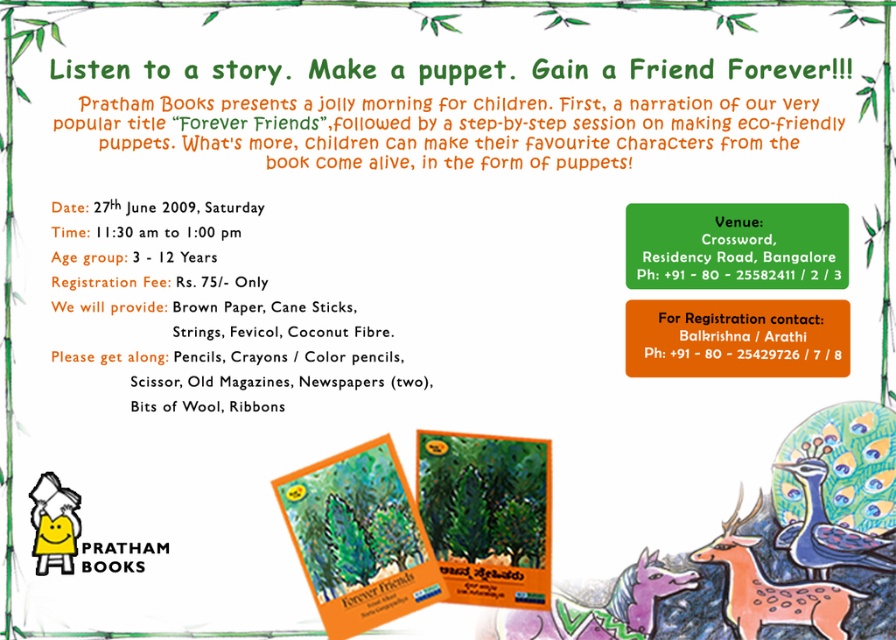
Can you confirm if matte orange deer at center is positioned below blue glossy peacock at center?

Yes, matte orange deer at center is below blue glossy peacock at center.

Which of these two, matte orange deer at center or blue glossy peacock at center, stands taller?

matte orange deer at center is taller.

Measure the distance between point (765,616) and camera.

Point (765,616) is 3.60 feet away from camera.

In order to click on matte orange deer at center in this screenshot , I will do `click(771, 588)`.

Which is more to the left, brown paper at upper left or matte orange book at lower left?

Positioned to the left is matte orange book at lower left.

What do you see at coordinates (240, 307) in the screenshot?
I see `brown paper at upper left` at bounding box center [240, 307].

Locate an element on the screen. brown paper at upper left is located at coordinates (240, 307).

Can you confirm if orange text at upper center is shorter than purple felt unicorn at lower center?

Correct, orange text at upper center is not as tall as purple felt unicorn at lower center.

Is orange text at upper center closer to camera compared to purple felt unicorn at lower center?

That is True.

Does point (695, 124) come in front of point (618, 605)?

That is True.

Find the location of `orange text at upper center`. orange text at upper center is located at coordinates (656, 129).